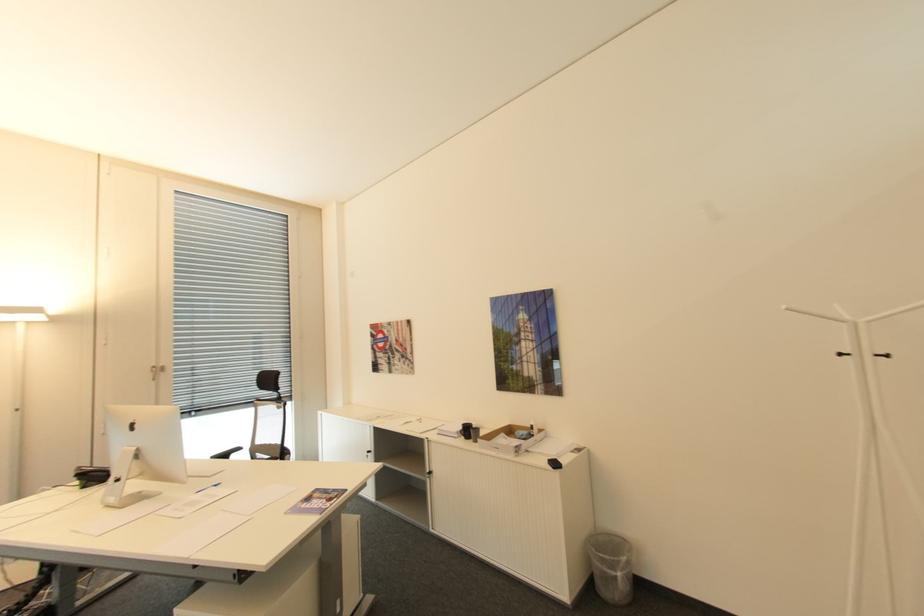
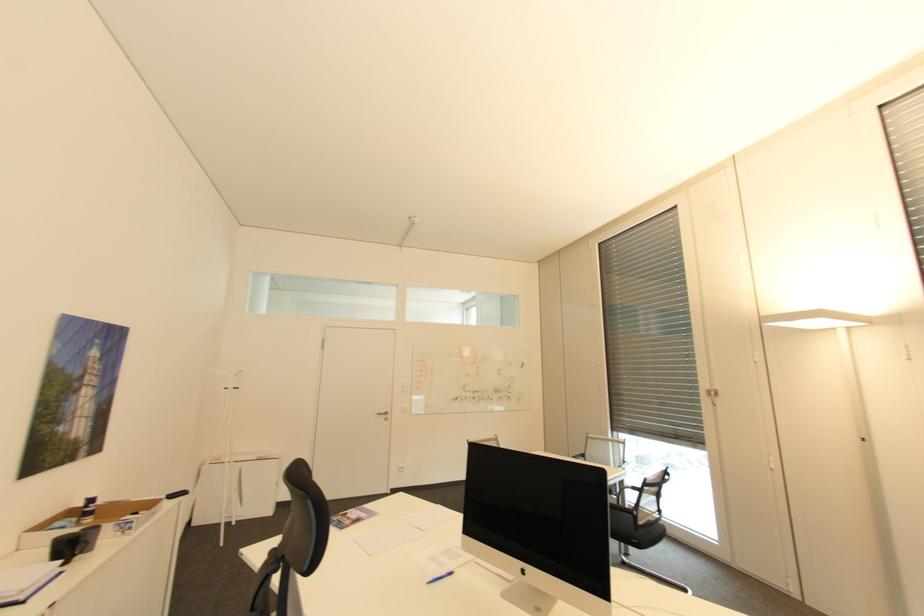
Where in the second image is the point corresponding to pixel 223 484 from the first image?

(434, 582)